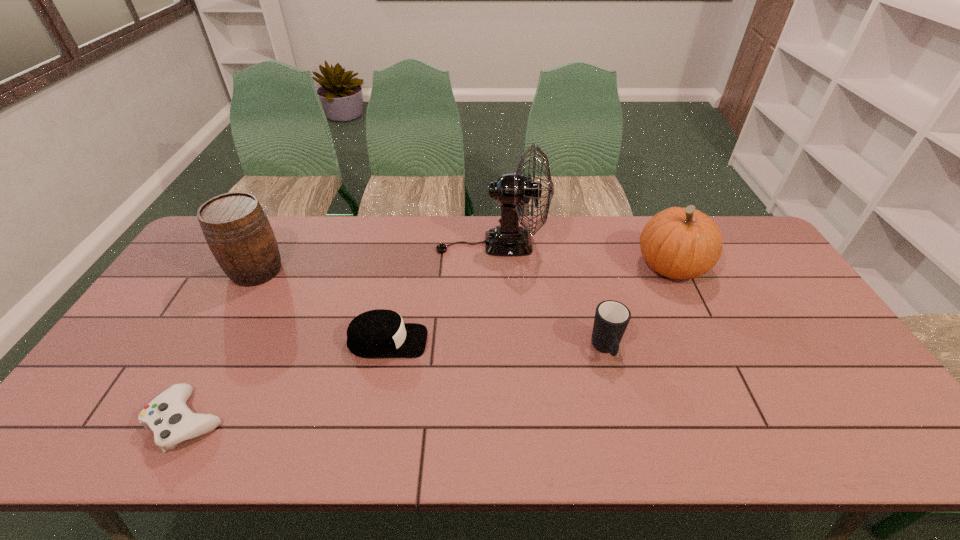
The width and height of the screenshot is (960, 540). Identify the location of cider at the far edge. (236, 228).

The width and height of the screenshot is (960, 540). I want to click on object located in the near edge section of the desktop, so click(167, 415).

This screenshot has height=540, width=960. In order to click on object present at the left edge in this screenshot , I will do `click(236, 228)`.

Locate an element on the screen. Image resolution: width=960 pixels, height=540 pixels. object located at the far left corner is located at coordinates (236, 228).

Find the location of a particular element. free space at the far edge is located at coordinates (383, 258).

In the image, there is a desktop. Where is `vacant area at the near edge`? Image resolution: width=960 pixels, height=540 pixels. vacant area at the near edge is located at coordinates (577, 436).

The height and width of the screenshot is (540, 960). Identify the location of free location at the left edge. (191, 269).

Locate an element on the screen. vacant space at the right edge of the desktop is located at coordinates (787, 329).

Image resolution: width=960 pixels, height=540 pixels. In order to click on free point between the cap and the nearest object in this screenshot , I will do `click(288, 381)`.

Locate an element on the screen. vacant space that is in between the cap and the shortest object is located at coordinates (288, 381).